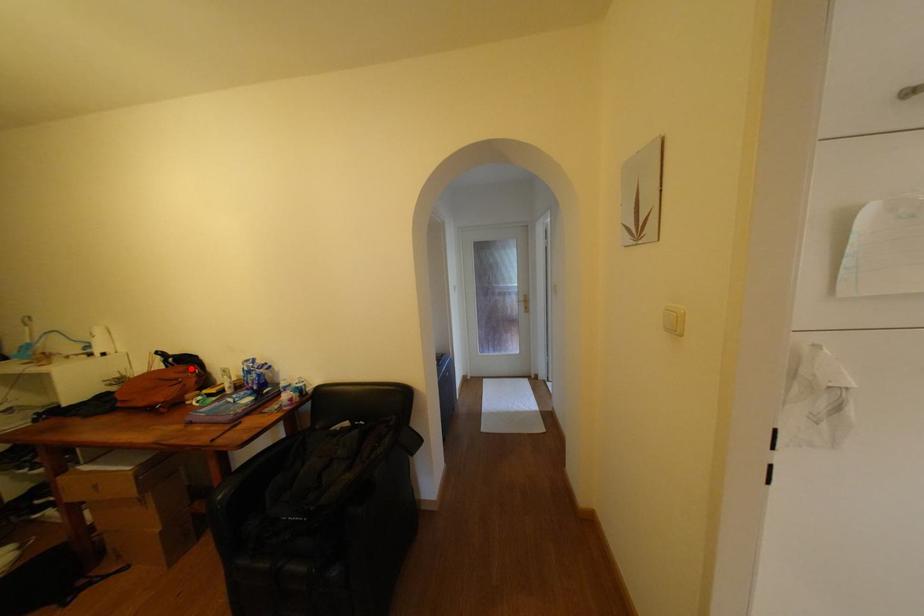
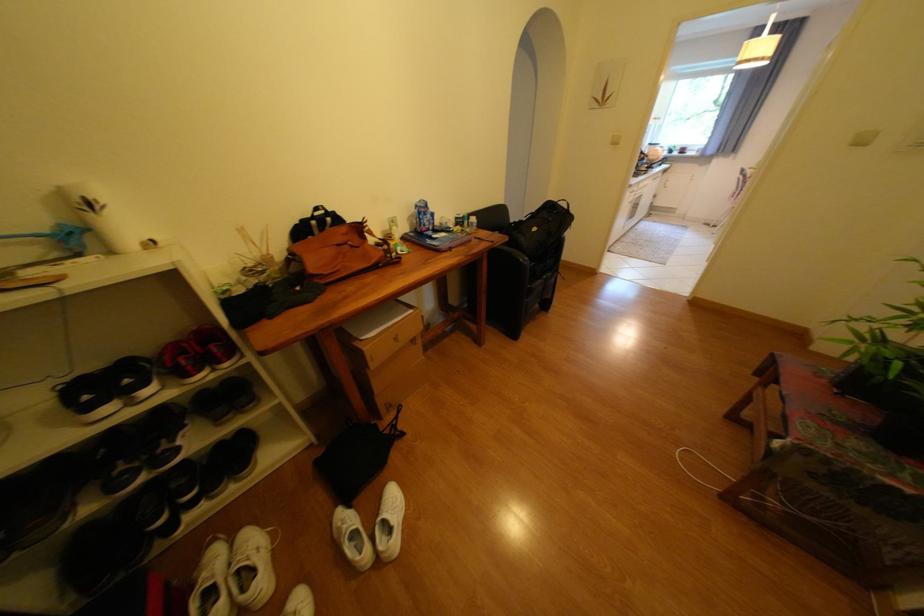
Find the pixel in the second image that matches the highlighted location in the first image.

(351, 229)